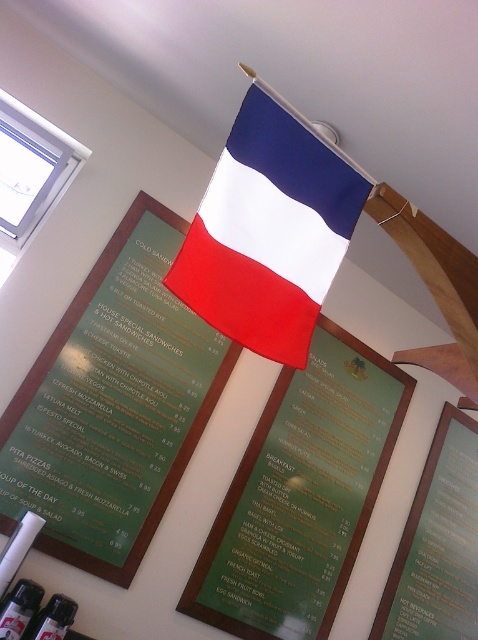
Question: Which object is closer to the camera taking this photo?

Choices:
 (A) green matte menu board at center
 (B) matte fabric flag at upper center
 (C) green matte menu at center

Answer: (B)

Question: Can you confirm if green glossy menu at center is bigger than matte fabric flag at upper center?

Choices:
 (A) no
 (B) yes

Answer: (B)

Question: Which of the following is the farthest from the observer?

Choices:
 (A) (323, 429)
 (B) (440, 566)
 (C) (141, 435)
 (D) (249, 321)

Answer: (B)

Question: Observing the image, what is the correct spatial positioning of green matte menu board at center in reference to green matte menu at center?

Choices:
 (A) below
 (B) above

Answer: (B)

Question: Is matte fabric flag at upper center smaller than green matte menu at center?

Choices:
 (A) yes
 (B) no

Answer: (A)

Question: Which point is closer to the camera taking this photo?

Choices:
 (A) (425, 636)
 (B) (351, 522)
 (C) (231, 152)
 (D) (136, 268)

Answer: (C)